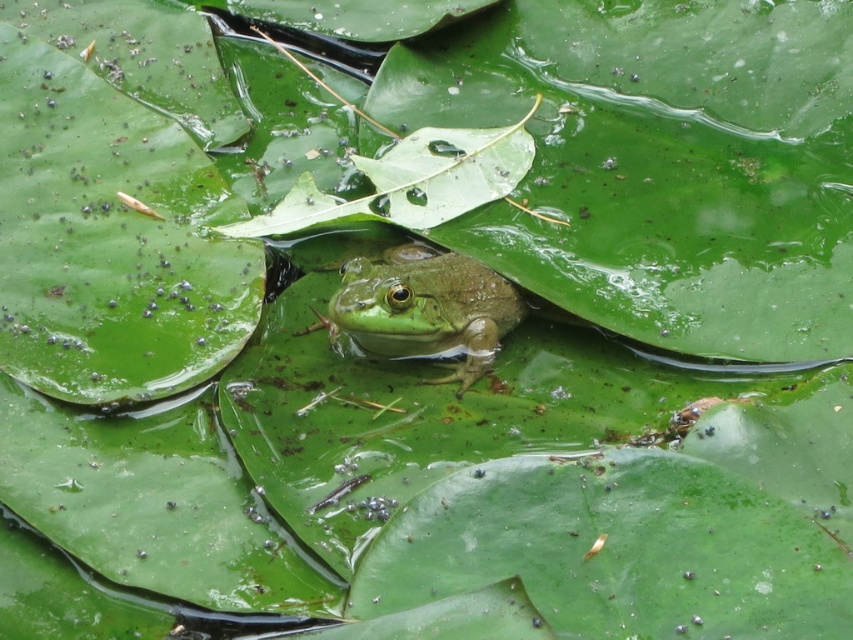
Consider the image. You are a photographer trying to capture the green matte tree frog at center and the green matte leaf at center in the same frame. Based on their positions, which object should you adjust your camera to focus on first to ensure both are in the shot?

The green matte tree frog at center is to the right of the green matte leaf at center, so you should focus on the green matte leaf at center first to ensure both are in the frame.

You are a photographer trying to capture a clear image of the green matte tree frog at center and the green matte leaf at center. Which object will appear closer to the camera lens in the photo?

The green matte tree frog at center will appear closer to the camera lens in the photo because it is positioned in front of the green matte leaf at center.

You are a small insect flying over a pond. You see a green matte tree frog at center and a green matte leaf at center. Which one is wider?

The green matte tree frog at center is narrower than the green matte leaf at center, so the leaf is wider.